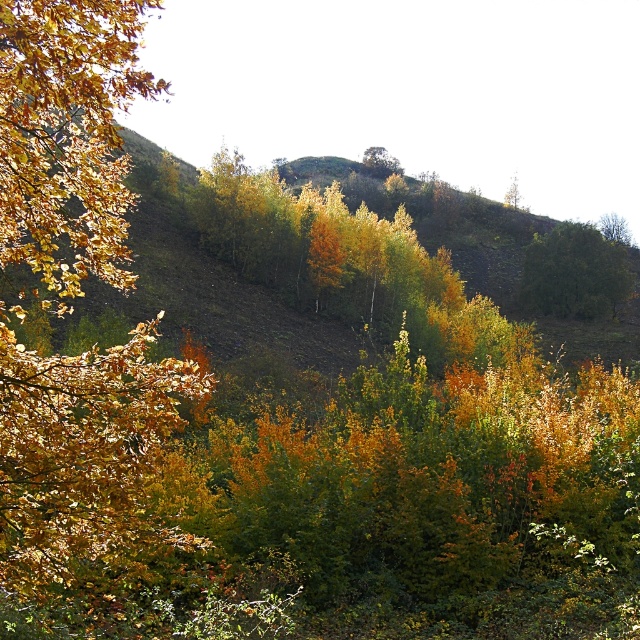
Which is above, golden leafy branch at left or green leafy tree at center?

Positioned higher is green leafy tree at center.

Does golden leafy branch at left have a smaller size compared to green leafy tree at center?

Incorrect, golden leafy branch at left is not smaller in size than green leafy tree at center.

Is point (4, 561) more distant than point (564, 232)?

That is False.

I want to click on golden leafy branch at left, so click(83, 460).

This screenshot has width=640, height=640. What do you see at coordinates (83, 460) in the screenshot? I see `golden leafy branch at left` at bounding box center [83, 460].

Does point (120, 408) lie behind point (627, 237)?

No.

Is point (13, 134) positioned before point (604, 225)?

Yes.

Identify the location of golden leafy branch at left. Image resolution: width=640 pixels, height=640 pixels. (83, 460).

Can you confirm if green leafy tree at center is positioned above green matte tree at upper right?

No.

The height and width of the screenshot is (640, 640). Identify the location of green leafy tree at center. (573, 273).

Find the location of `green leafy tree at center`. green leafy tree at center is located at coordinates (573, 273).